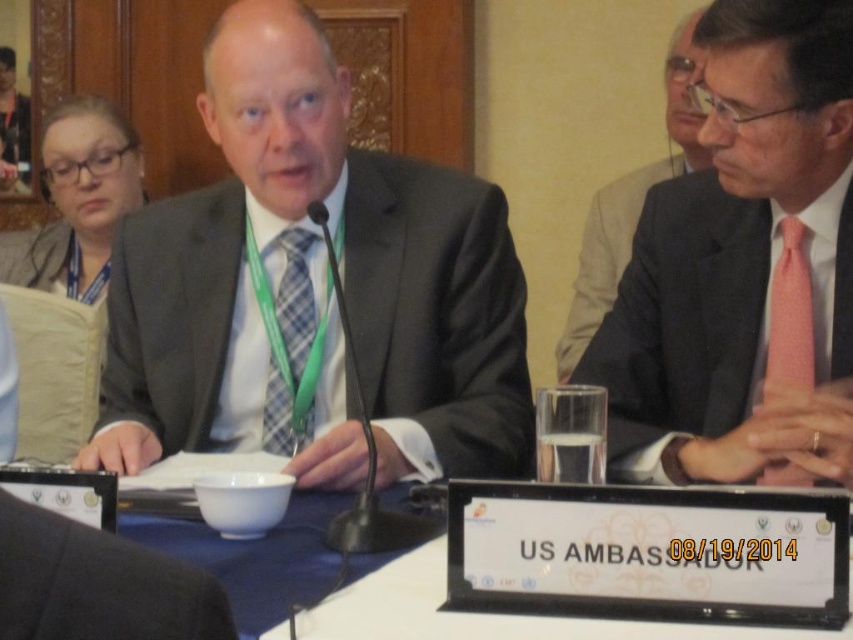
Who is positioned more to the left, matte black suit at center or black fabric business suit at lower left?

matte black suit at center is more to the left.

Who is positioned more to the right, matte black suit at center or black fabric business suit at lower left?

Positioned to the right is black fabric business suit at lower left.

Is point (430, 273) in front of point (94, 536)?

No, (430, 273) is further to viewer.

Locate an element on the screen. matte black suit at center is located at coordinates (312, 289).

Can you confirm if pink silk tie at right is bigger than black fabric business suit at lower left?

Indeed, pink silk tie at right has a larger size compared to black fabric business suit at lower left.

Between pink silk tie at right and black fabric business suit at lower left, which one is positioned lower?

black fabric business suit at lower left

Describe the element at coordinates (689, 337) in the screenshot. I see `pink silk tie at right` at that location.

Locate an element on the screen. Image resolution: width=853 pixels, height=640 pixels. pink silk tie at right is located at coordinates (689, 337).

Is matte black suit at center smaller than pink dotted tie at right?

No, matte black suit at center is not smaller than pink dotted tie at right.

Which is behind, point (207, 280) or point (788, 472)?

Positioned behind is point (207, 280).

Find the location of a particular element. Image resolution: width=853 pixels, height=640 pixels. matte black suit at center is located at coordinates (312, 289).

I want to click on matte black suit at center, so click(312, 289).